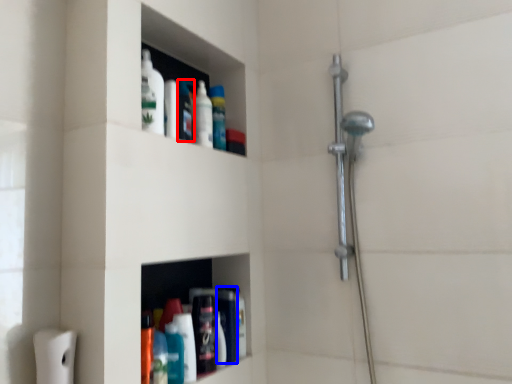
Question: Which object appears closest to the camera in this image, toiletry (highlighted by a red box) or toiletry (highlighted by a blue box)?

Choices:
 (A) toiletry
 (B) toiletry

Answer: (A)